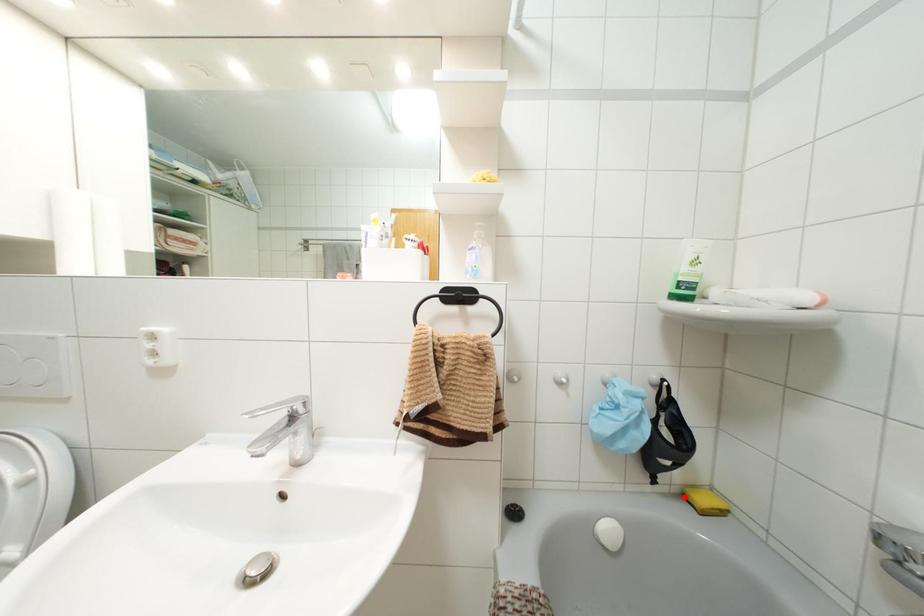
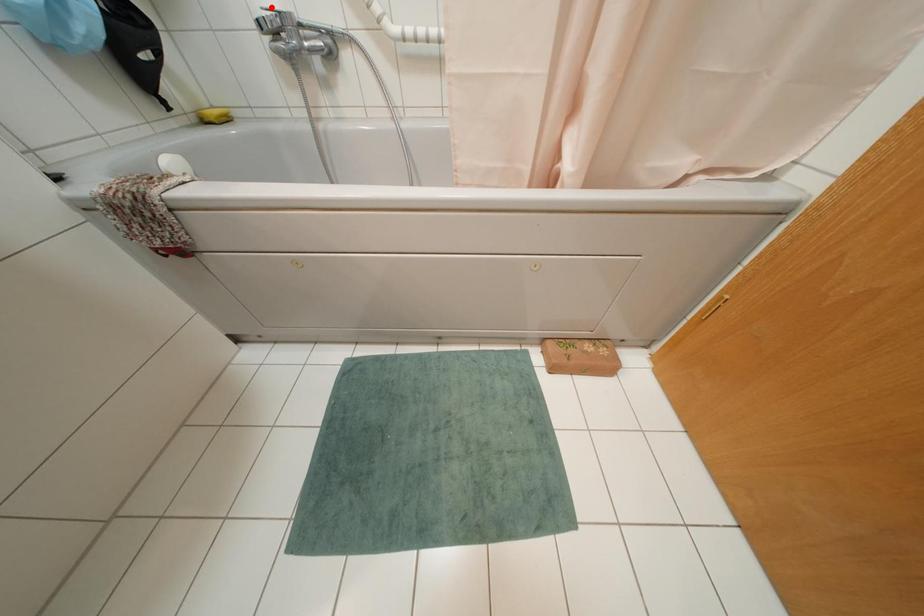
I am providing you with two images of the same scene from different viewpoints. A red point is marked on the first image and another point is marked on the second image. Is the marked point in image1 the same physical position as the marked point in image2?

No